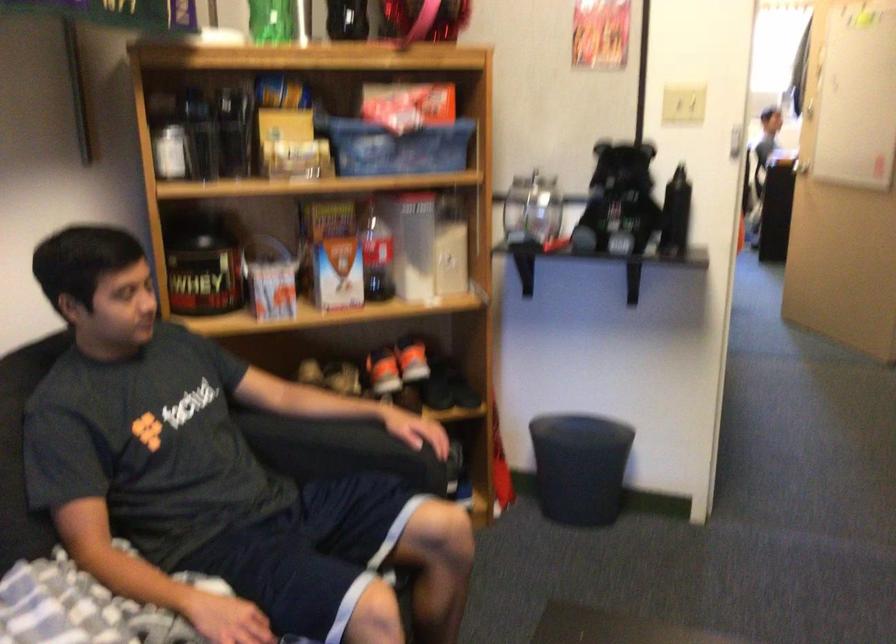
Locate an element on the screen. black water bottle is located at coordinates pos(675,214).